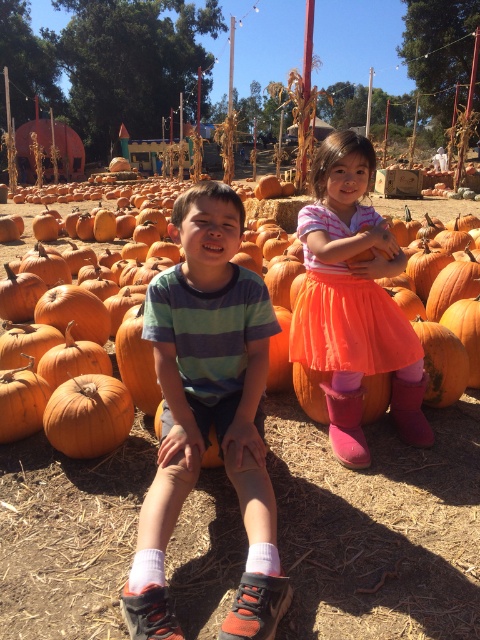
Question: Among these points, which one is nearest to the camera?

Choices:
 (A) (295, 340)
 (B) (175, 209)

Answer: (B)

Question: Among these objects, which one is farthest from the camera?

Choices:
 (A) striped cotton shirt at center
 (B) pink tulle skirt at center

Answer: (B)

Question: Can you confirm if striped cotton shirt at center is smaller than pink tulle skirt at center?

Choices:
 (A) no
 (B) yes

Answer: (B)

Question: Based on their relative distances, which object is farther from the pink tulle skirt at center?

Choices:
 (A) striped cotton shirt at center
 (B) orange matte pumpkin at center

Answer: (B)

Question: Is pink tulle skirt at center to the right of orange matte pumpkin at center from the viewer's perspective?

Choices:
 (A) yes
 (B) no

Answer: (A)

Question: Does striped cotton shirt at center have a smaller size compared to pink tulle skirt at center?

Choices:
 (A) yes
 (B) no

Answer: (A)